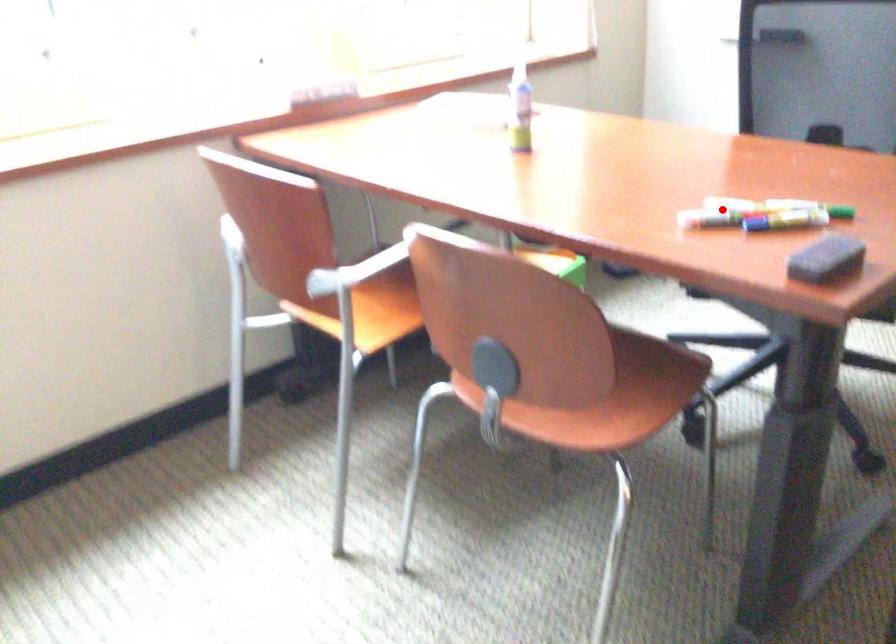
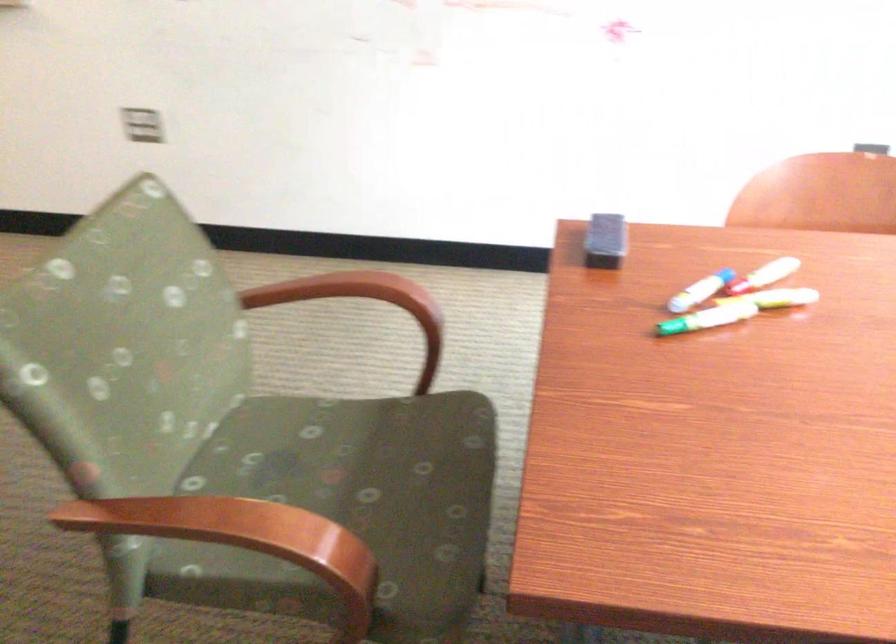
The point at the highlighted location is marked in the first image. Where is the corresponding point in the second image?

(776, 298)